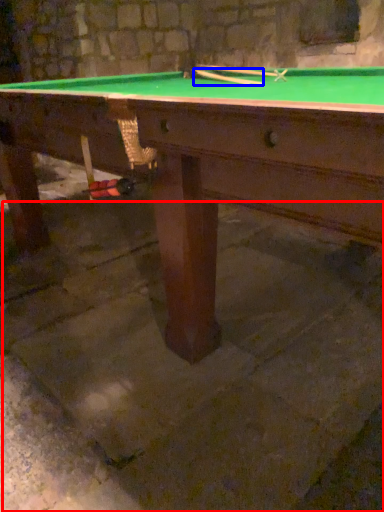
Question: Which object appears farthest to the camera in this image, concrete (highlighted by a red box) or cue (highlighted by a blue box)?

Choices:
 (A) concrete
 (B) cue

Answer: (B)